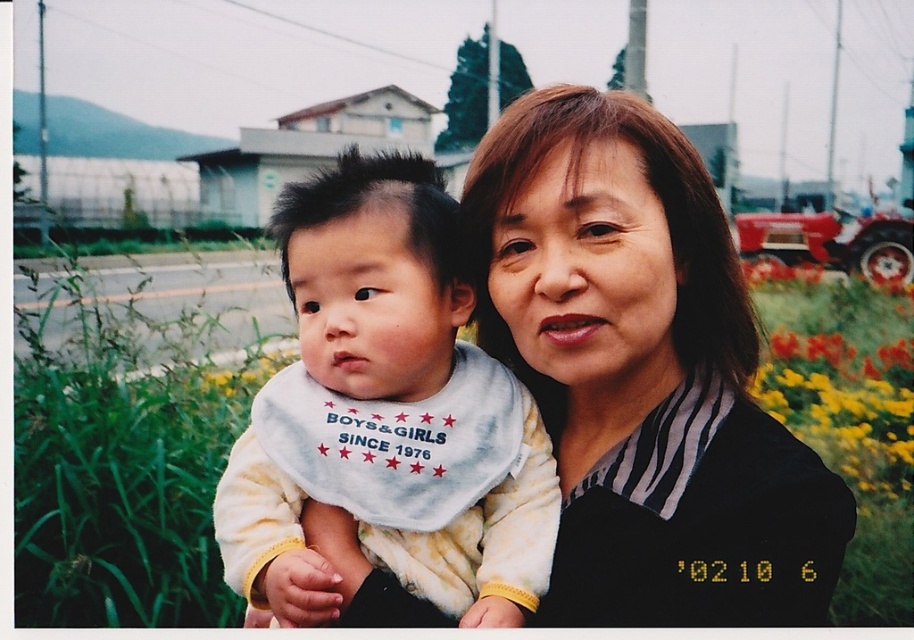
Does point (314, 244) come behind point (879, 413)?

No, it is not.

Can you confirm if white fleece bib at center is positioned below yellow fabric flower at right?

No.

What do you see at coordinates (392, 408) in the screenshot? I see `white fleece bib at center` at bounding box center [392, 408].

Locate an element on the screen. white fleece bib at center is located at coordinates (392, 408).

Is smooth black shirt at center smaller than yellow fabric flower at right?

Yes, smooth black shirt at center is smaller than yellow fabric flower at right.

In the scene shown: Is smooth black shirt at center further to camera compared to yellow fabric flower at right?

No, smooth black shirt at center is in front of yellow fabric flower at right.

At what (x,y) coordinates should I click in order to perform the action: click on smooth black shirt at center. Please return your answer as a coordinate pair (x, y). The height and width of the screenshot is (640, 914). Looking at the image, I should click on (643, 374).

Can you confirm if smooth black shirt at center is wider than white fleece bib at center?

No.

Which is in front, point (594, 522) or point (232, 586)?

Positioned in front is point (594, 522).

This screenshot has height=640, width=914. Describe the element at coordinates (643, 374) in the screenshot. I see `smooth black shirt at center` at that location.

At what (x,y) coordinates should I click in order to perform the action: click on smooth black shirt at center. Please return your answer as a coordinate pair (x, y). This screenshot has height=640, width=914. Looking at the image, I should click on (643, 374).